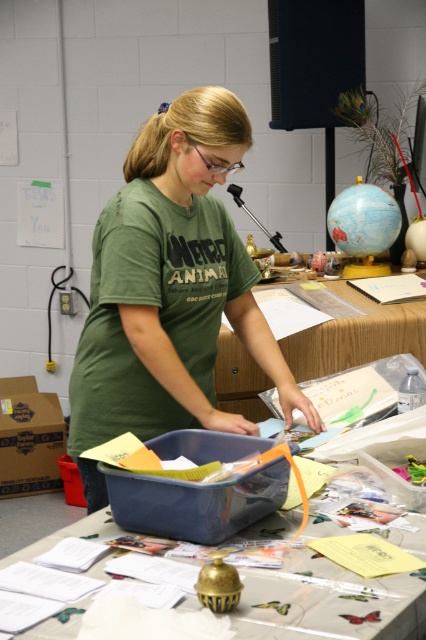
You are a delivery robot that needs to place a package on the wooden table at center. The package is 12 inches wide. Can you safely place it on the table without hitting the green matte shirt at center?

The distance between the green matte shirt at center and the wooden table at center is 25.30 inches. Since the package is only 12 inches wide, there is enough space to place it on the wooden table at center without disturbing the shirt.

Consider the image. You are trying to place a small item on the table where the person is working. Which table should you use, the translucent plastic table at center or the wooden table at center?

You should use the wooden table at center because the translucent plastic table at center is in front of it, meaning the wooden table is the one the person is actually working on.

You are standing in front of the table with the butterfly tablecloth and need to place a small golden bell on the table. You have two points marked on the table where you can place it. The points are at coordinates point (x=164, y=172) and point (x=256, y=582). Which point is closer to you when viewed from your position?

Point (x=164, y=172) is closer to you because it is further to the viewer than point (x=256, y=582).